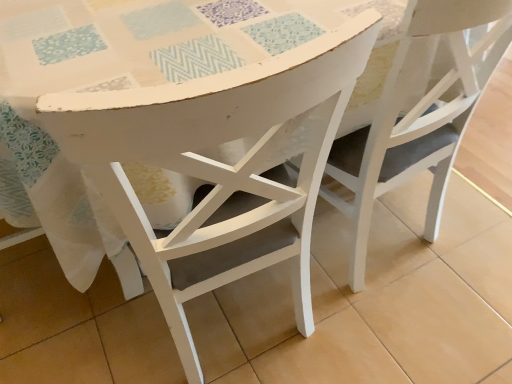
In order to face white matte chair at center, marked as the 2th chair in a left-to-right arrangement, should I rotate leftwards or rightwards?

It's best to rotate right around 15.751 degrees.

Identify the location of white matte chair at center, marked as the 2th chair in a left-to-right arrangement. click(x=417, y=120).

What is the approximate height of white matte chair at center, marked as the 2th chair in a left-to-right arrangement?

34.74 inches.

Describe the element at coordinates (417, 120) in the screenshot. I see `white matte chair at center, acting as the first chair starting from the right` at that location.

Where is `white matte chair at center, the first chair viewed from the left`? This screenshot has width=512, height=384. white matte chair at center, the first chair viewed from the left is located at coordinates (219, 167).

Describe the element at coordinates (219, 167) in the screenshot. This screenshot has width=512, height=384. I see `white matte chair at center, the first chair viewed from the left` at that location.

Measure the distance between point (229,218) and camera.

The distance of point (229,218) from camera is 32.48 inches.

Locate an element on the screen. This screenshot has width=512, height=384. white matte chair at center, marked as the 2th chair in a left-to-right arrangement is located at coordinates (417, 120).

In the image, is white matte chair at center, the first chair viewed from the left, on the left side or the right side of white matte chair at center, marked as the 2th chair in a left-to-right arrangement?

Clearly, white matte chair at center, the first chair viewed from the left, is on the left of white matte chair at center, marked as the 2th chair in a left-to-right arrangement, in the image.

Is the depth of white matte chair at center, the first chair viewed from the left, greater than that of white matte chair at center, marked as the 2th chair in a left-to-right arrangement?

No, the depth of white matte chair at center, the first chair viewed from the left, is less than that of white matte chair at center, marked as the 2th chair in a left-to-right arrangement.

Which is behind, point (108, 132) or point (414, 139)?

The point (414, 139) is farther from the camera.

Based on the photo, from the image's perspective, which one is positioned lower, white matte chair at center, the first chair viewed from the left, or white matte chair at center, marked as the 2th chair in a left-to-right arrangement?

From the image's view, white matte chair at center, the first chair viewed from the left, is below.

From a real-world perspective, who is located higher, white matte chair at center, the first chair viewed from the left, or white matte chair at center, marked as the 2th chair in a left-to-right arrangement?

white matte chair at center, the first chair viewed from the left, from a real-world perspective.

Looking at their sizes, would you say white matte chair at center, arranged as the second chair when viewed from the right, is wider or thinner than white matte chair at center, acting as the first chair starting from the right?

Clearly, white matte chair at center, arranged as the second chair when viewed from the right, has less width compared to white matte chair at center, acting as the first chair starting from the right.

Considering the sizes of objects white matte chair at center, arranged as the second chair when viewed from the right, and white matte chair at center, acting as the first chair starting from the right, in the image provided, who is taller, white matte chair at center, arranged as the second chair when viewed from the right, or white matte chair at center, acting as the first chair starting from the right,?

With more height is white matte chair at center, arranged as the second chair when viewed from the right.

Is white matte chair at center, arranged as the second chair when viewed from the right, smaller than white matte chair at center, marked as the 2th chair in a left-to-right arrangement?

Yes, white matte chair at center, arranged as the second chair when viewed from the right, is smaller than white matte chair at center, marked as the 2th chair in a left-to-right arrangement.

Is white matte chair at center, the first chair viewed from the left, completely or partially outside of white matte chair at center, marked as the 2th chair in a left-to-right arrangement?

white matte chair at center, the first chair viewed from the left, lies outside white matte chair at center, marked as the 2th chair in a left-to-right arrangement,'s area.

Does white matte chair at center, arranged as the second chair when viewed from the right, touch white matte chair at center, marked as the 2th chair in a left-to-right arrangement?

No, white matte chair at center, arranged as the second chair when viewed from the right, is not in contact with white matte chair at center, marked as the 2th chair in a left-to-right arrangement.

Is white matte chair at center, acting as the first chair starting from the right, at the back of white matte chair at center, the first chair viewed from the left?

white matte chair at center, the first chair viewed from the left, is not turned away from white matte chair at center, acting as the first chair starting from the right.

Image resolution: width=512 pixels, height=384 pixels. I want to click on chair above the white matte chair at center, marked as the 2th chair in a left-to-right arrangement (from a real-world perspective), so click(219, 167).

Can you confirm if white matte chair at center, acting as the first chair starting from the right, is positioned to the right of white matte chair at center, arranged as the second chair when viewed from the right?

Yes.

Which object is closer to the camera taking this photo, white matte chair at center, acting as the first chair starting from the right, or white matte chair at center, the first chair viewed from the left?

white matte chair at center, the first chair viewed from the left, is more forward.

Based on the photo, which is closer, (360, 187) or (205, 157)?

The point (205, 157) is closer.

From the image's perspective, between white matte chair at center, marked as the 2th chair in a left-to-right arrangement, and white matte chair at center, arranged as the second chair when viewed from the right, who is located below?

From the image's view, white matte chair at center, arranged as the second chair when viewed from the right, is below.

From a real-world perspective, is white matte chair at center, acting as the first chair starting from the right, positioned over white matte chair at center, the first chair viewed from the left, based on gravity?

Actually, white matte chair at center, acting as the first chair starting from the right, is physically below white matte chair at center, the first chair viewed from the left, in the real world.

Consider the image. Does white matte chair at center, marked as the 2th chair in a left-to-right arrangement, have a lesser width compared to white matte chair at center, the first chair viewed from the left?

In fact, white matte chair at center, marked as the 2th chair in a left-to-right arrangement, might be wider than white matte chair at center, the first chair viewed from the left.

Based on the photo, considering the relative sizes of white matte chair at center, marked as the 2th chair in a left-to-right arrangement, and white matte chair at center, arranged as the second chair when viewed from the right, in the image provided, is white matte chair at center, marked as the 2th chair in a left-to-right arrangement, taller than white matte chair at center, arranged as the second chair when viewed from the right,?

In fact, white matte chair at center, marked as the 2th chair in a left-to-right arrangement, may be shorter than white matte chair at center, arranged as the second chair when viewed from the right.

Considering the sizes of objects white matte chair at center, marked as the 2th chair in a left-to-right arrangement, and white matte chair at center, the first chair viewed from the left, in the image provided, who is smaller, white matte chair at center, marked as the 2th chair in a left-to-right arrangement, or white matte chair at center, the first chair viewed from the left,?

With smaller size is white matte chair at center, the first chair viewed from the left.

Is white matte chair at center, arranged as the second chair when viewed from the right, surrounded by white matte chair at center, marked as the 2th chair in a left-to-right arrangement?

Actually, white matte chair at center, arranged as the second chair when viewed from the right, is outside white matte chair at center, marked as the 2th chair in a left-to-right arrangement.

Is white matte chair at center, acting as the first chair starting from the right, far from white matte chair at center, the first chair viewed from the left?

They are positioned close to each other.

Could you tell me if white matte chair at center, acting as the first chair starting from the right, is turned towards white matte chair at center, arranged as the second chair when viewed from the right?

No, white matte chair at center, acting as the first chair starting from the right, is not aimed at white matte chair at center, arranged as the second chair when viewed from the right.

Locate an element on the screen. The width and height of the screenshot is (512, 384). chair located underneath the white matte chair at center, the first chair viewed from the left (from a real-world perspective) is located at coordinates [417, 120].

Where is `chair on the left of white matte chair at center, acting as the first chair starting from the right`? This screenshot has width=512, height=384. chair on the left of white matte chair at center, acting as the first chair starting from the right is located at coordinates (219, 167).

The width and height of the screenshot is (512, 384). I want to click on chair above the white matte chair at center, arranged as the second chair when viewed from the right (from the image's perspective), so click(x=417, y=120).